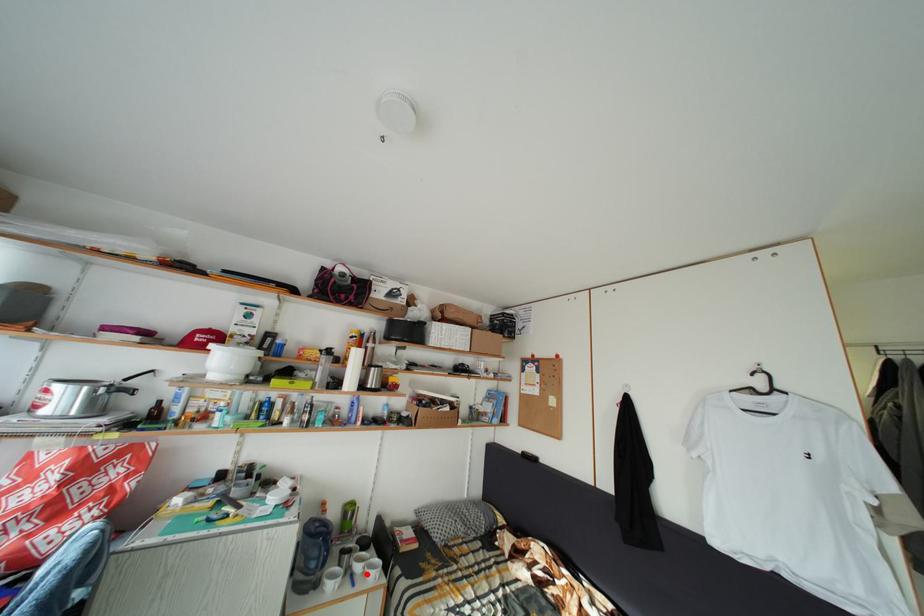
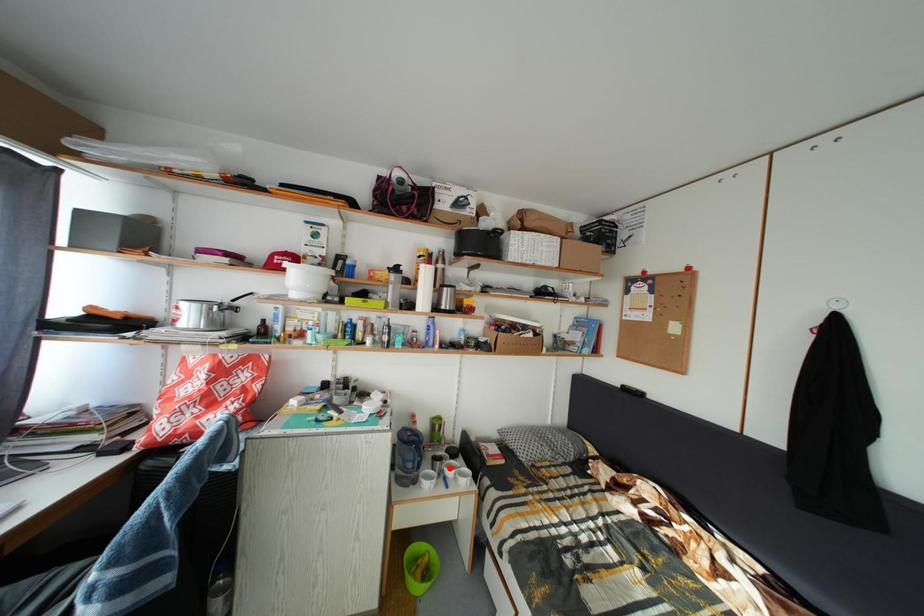
Looking at this image, I am providing you with two images of the same scene from different viewpoints. A red point is marked on the first image and another point is marked on the second image. Is the red point in image1 aligned with the point shown in image2?

No